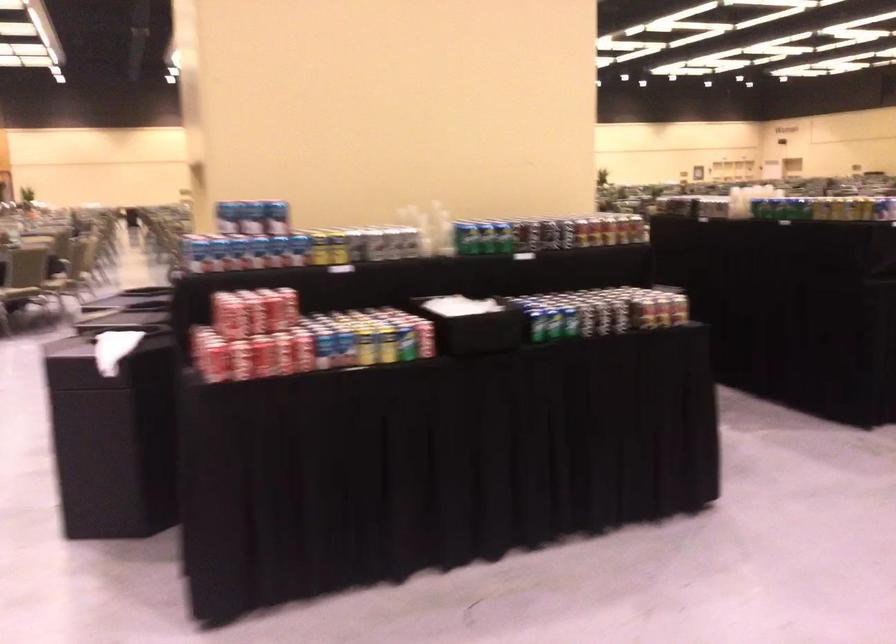
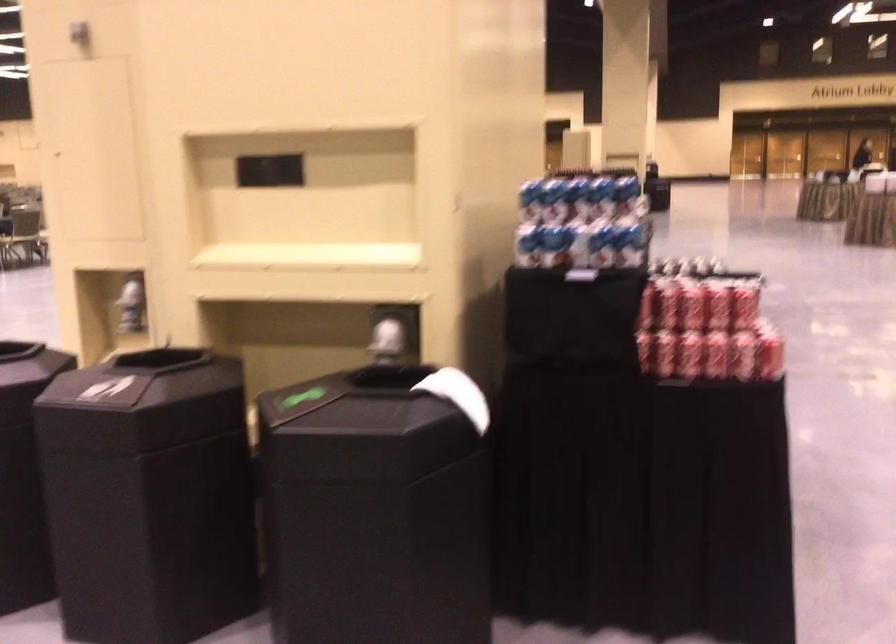
The point at (194, 346) is marked in the first image. Where is the corresponding point in the second image?

(688, 355)